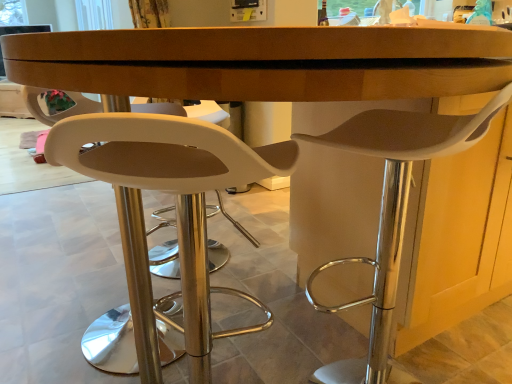
Question: Which is correct: white plastic chair at center, marked as the second chair in a right-to-left arrangement, is inside white plastic stool at right, the second chair viewed from the front, or outside of it?

Choices:
 (A) inside
 (B) outside

Answer: (B)

Question: Visually, is white plastic chair at center, placed as the 2th chair when sorted from back to front, positioned to the left or to the right of white plastic stool at right, the first chair from the back?

Choices:
 (A) right
 (B) left

Answer: (B)

Question: From the image's perspective, relative to white plastic stool at right, the 1th chair viewed from the right, is white plastic chair at center, placed as the 2th chair when sorted from back to front, above or below?

Choices:
 (A) below
 (B) above

Answer: (A)

Question: Is white plastic stool at right, the 1th chair viewed from the right, in front of or behind white plastic chair at center, acting as the 1th chair starting from the front, in the image?

Choices:
 (A) front
 (B) behind

Answer: (B)

Question: Looking at the image, does white plastic stool at right, the 1th chair viewed from the right, seem bigger or smaller compared to white plastic chair at center, which is counted as the first chair, starting from the left?

Choices:
 (A) big
 (B) small

Answer: (A)

Question: Considering the relative positions of white plastic stool at right, the 1th chair viewed from the right, and white plastic chair at center, acting as the 1th chair starting from the front, in the image provided, is white plastic stool at right, the 1th chair viewed from the right, to the left or to the right of white plastic chair at center, acting as the 1th chair starting from the front,?

Choices:
 (A) right
 (B) left

Answer: (A)

Question: Is point (397, 192) closer or farther from the camera than point (258, 170)?

Choices:
 (A) farther
 (B) closer

Answer: (A)